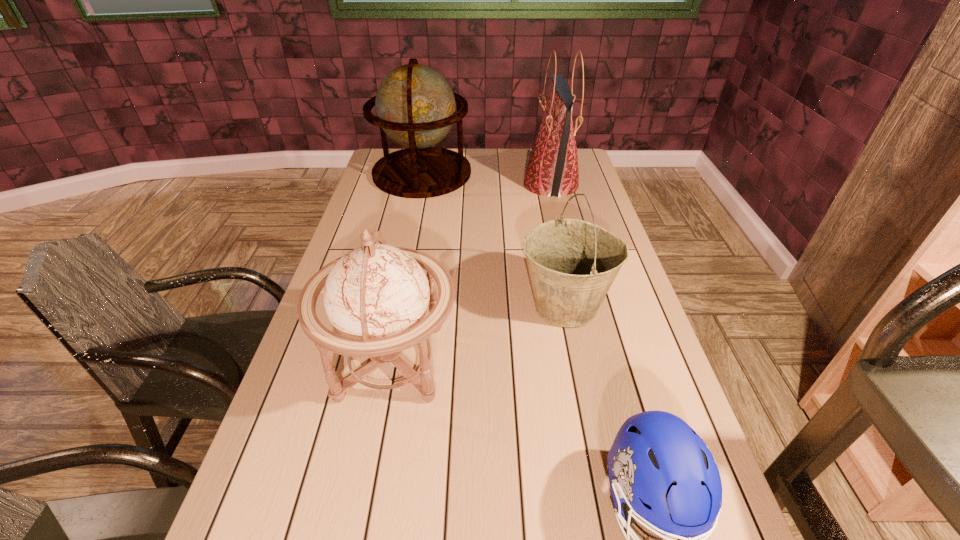
Where is `handbag`? This screenshot has width=960, height=540. handbag is located at coordinates (552, 169).

Locate an element on the screen. The image size is (960, 540). the farther globe is located at coordinates coord(415,106).

This screenshot has height=540, width=960. Identify the location of the nearer globe. (376, 296).

Identify the location of wine bucket. The height and width of the screenshot is (540, 960). (572, 264).

Identify the location of vacant position located 0.350m on the front of the handbag. The image size is (960, 540). (572, 270).

In order to click on vacant space located 0.360m on the front-facing side of the farther globe in this screenshot , I will do `click(404, 260)`.

You are a GUI agent. You are given a task and a screenshot of the screen. Output one action in this format:
    pyautogui.click(x=<x>, y=<y>)
    Task: Click on the vacant space positioned 0.260m at the front of the nearer globe showing Africa
    This screenshot has height=540, width=960.
    Given the screenshot: What is the action you would take?
    pyautogui.click(x=565, y=361)

The width and height of the screenshot is (960, 540). In order to click on vacant position located on the back of the wine bucket in this screenshot , I will do `click(549, 224)`.

At what (x,y) coordinates should I click in order to perform the action: click on handbag at the far edge. Please return your answer as a coordinate pair (x, y). Looking at the image, I should click on (552, 169).

Image resolution: width=960 pixels, height=540 pixels. I want to click on globe that is at the far edge, so click(415, 106).